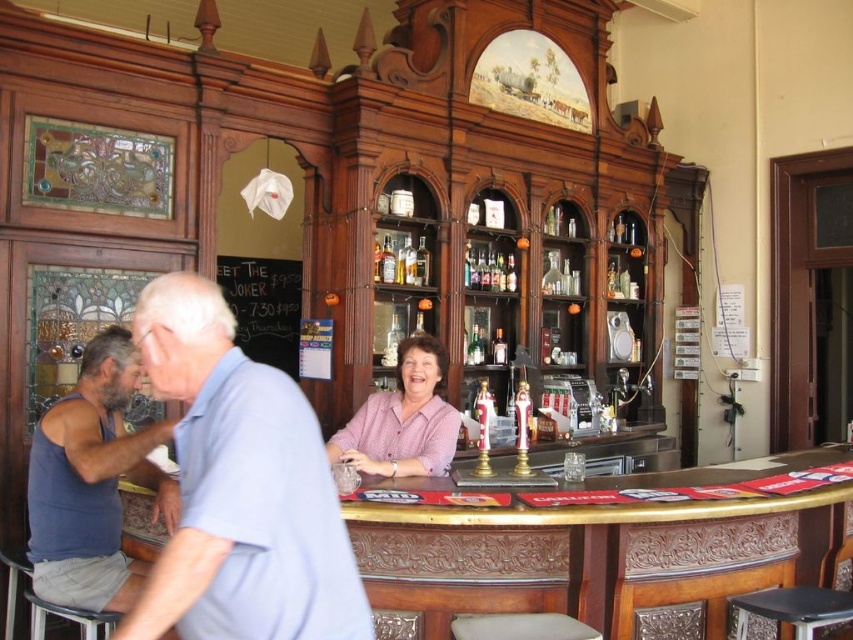
You are a customer at the bar and want to sit down. You see the black leather bar stool at lower right and the translucent glass bottle at center. Which object is located to the right of the other?

The black leather bar stool at lower right is positioned on the right side of the translucent glass bottle at center.

You are a customer at the bar and want to order a drink. You notice two shirts hanging on the back of the bar stools in front of you. The light blue cotton shirt at center and the pink woven blouse at center. Which shirt is taller?

The light blue cotton shirt at center is taller than the pink woven blouse at center.

You are a customer at the bar and want to hand a tip to the bartender who is wearing both the light blue cotton shirt at center and the pink woven blouse at center. Which article of clothing should you aim for to ensure your tip reaches them?

The light blue cotton shirt at center is closer to the viewer, so you should aim for the light blue cotton shirt at center to ensure your tip reaches the bartender.